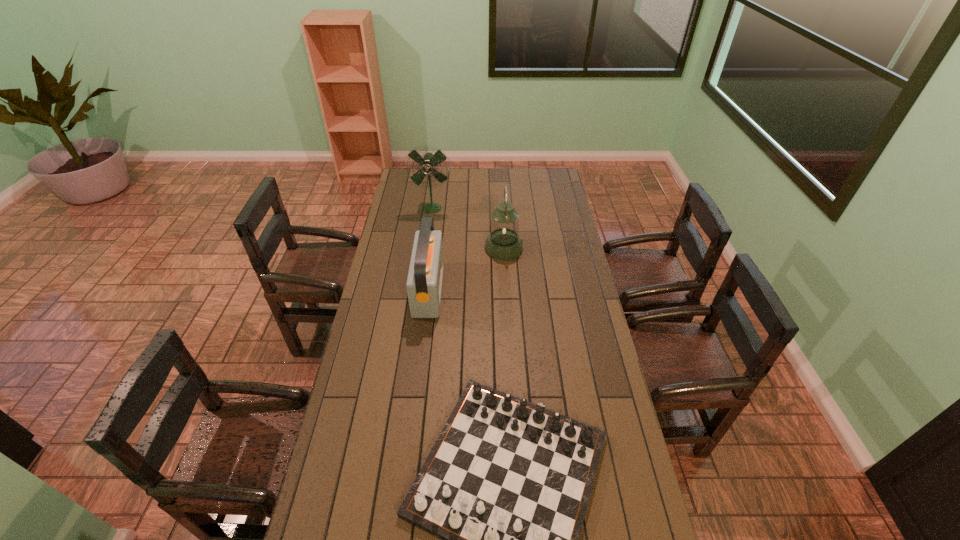
Find the location of a particular element. This screenshot has height=540, width=960. free location that satisfies the following two spatial constraints: 1. on the front-facing side of the lantern; 2. on the left side of the farthest object is located at coordinates (426, 248).